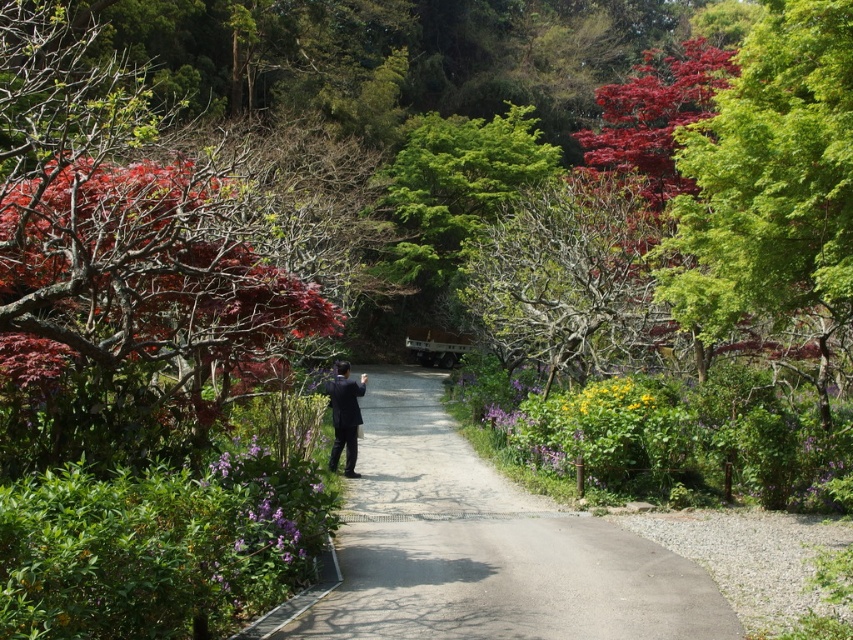
You are a photographer standing at the start of the garden pathway. You see a black suit at center and a yellow matte flower at center. Which object is positioned lower in the scene?

The black suit at center is positioned below the yellow matte flower at center, so it is lower in the scene.

You are a photographer standing at the end of the paved path in the garden. You want to take a photo that includes both the black suit at center and the yellow matte flower at center. Considering their heights, which object will appear larger in the photo?

The black suit at center is much taller than the yellow matte flower at center, so it will appear larger in the photo.